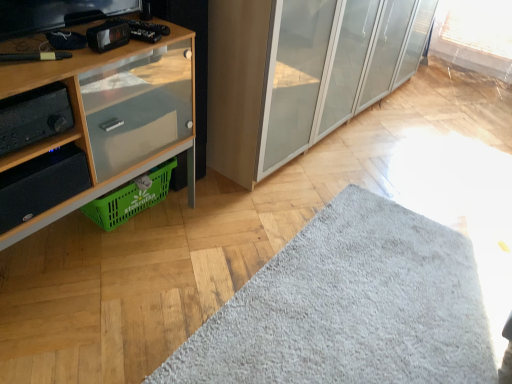
I want to click on free spot above wooden cabinet at left (from a real-world perspective), so click(78, 43).